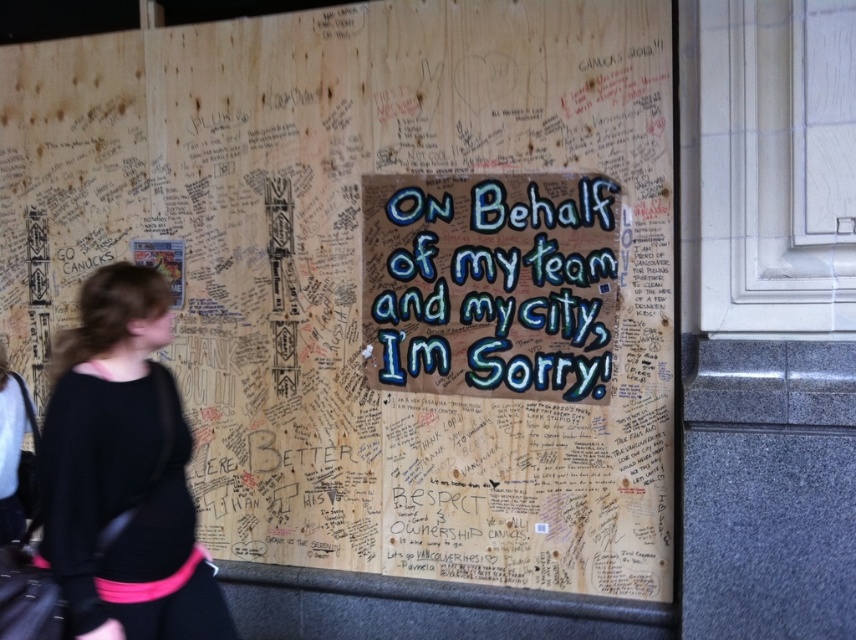
You are standing in front of the wooden wall with messages and want to touch both the point at coordinates point(611,218) and point(90,397). Which point will you reach first?

The point at coordinates point(611,218) is closer to you than point(90,397), so you will reach point(611,218) first.

You are an interior designer assessing the wall. You need to hang a new decorative item that must be taller than the black sweater at left. Can the blue painted wood sign at center be used for this purpose?

The blue painted wood sign at center is shorter than the black sweater at left, so it cannot be used as it does not meet the height requirement.

What is the relationship in position between the blue painted wood sign at center and the black sweater at left as observed from the image?

The blue painted wood sign at center is positioned over the black sweater at left, meaning it is located above and possibly covering part of the sweater in the image.